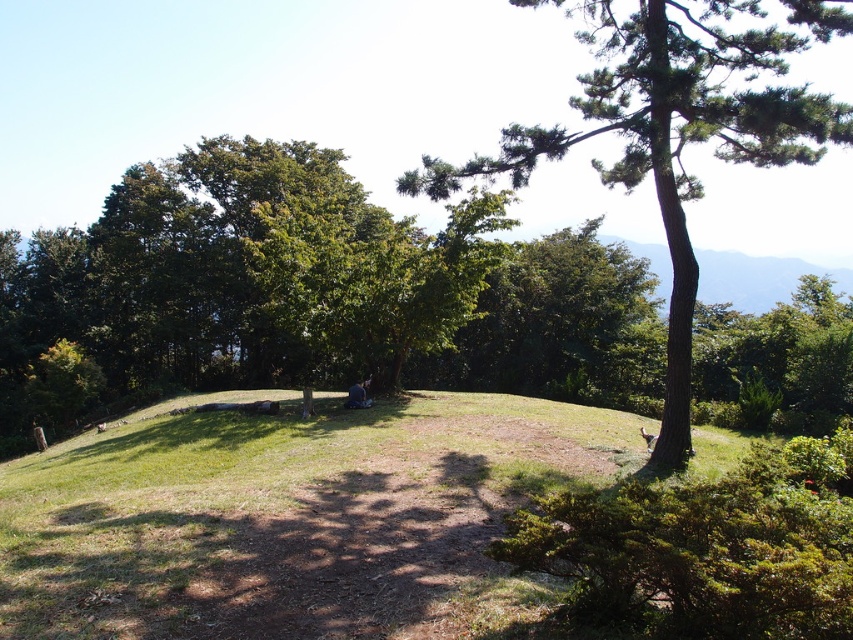
Question: Which point is farther to the camera?

Choices:
 (A) (346, 400)
 (B) (555, 1)

Answer: (A)

Question: Does green textured tree at center have a greater width compared to blue denim jeans at center?

Choices:
 (A) yes
 (B) no

Answer: (A)

Question: Is the position of green textured tree at center more distant than that of blue denim jeans at center?

Choices:
 (A) no
 (B) yes

Answer: (A)

Question: Can you confirm if green textured tree at center is positioned to the right of blue denim jeans at center?

Choices:
 (A) yes
 (B) no

Answer: (A)